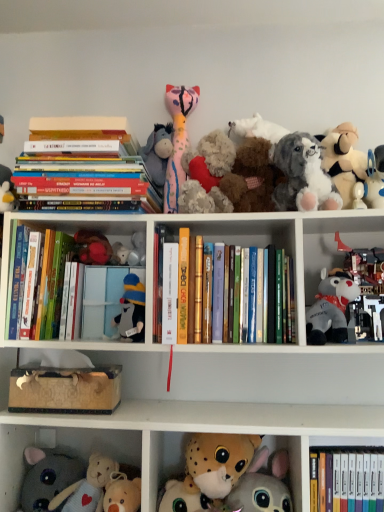
Question: Looking at the image, does fluffy plush toy at center, which is the third toy from left to right, seem bigger or smaller compared to fluffy white stuffed animal at upper right, the 1th toy from the right?

Choices:
 (A) small
 (B) big

Answer: (A)

Question: Is fluffy plush toy at center, which is the third toy from left to right, inside or outside of fluffy white stuffed animal at upper right, arranged as the ninth toy when viewed from the left?

Choices:
 (A) inside
 (B) outside

Answer: (B)

Question: Which of these objects is positioned farthest from the fluffy gray dog at upper right, placed as the 3th toy when sorted from right to left?

Choices:
 (A) hardcover book at center, the fourth book from the left
 (B) fluffy pink stuffed animal at upper center, which ranks as the fourth toy in right-to-left order
 (C) fluffy white stuffed animal at upper right, arranged as the ninth toy when viewed from the left
 (D) soft pink plush toy at upper center, placed as the sixth toy when sorted from right to left
 (E) fluffy white plush at lower center, which is the fifth toy from right to left

Answer: (E)

Question: Estimate the real-world distances between objects in this image. Which object is farther from the gray plush toy at right, which ranks as the 2th toy in right-to-left order?

Choices:
 (A) soft plush elephant at lower left, the ninth toy when ordered from right to left
 (B) hardcover book at left, the first book in the left-to-right sequence
 (C) hardcover book at center, which is the 1th paperback book from right to left
 (D) white plush toy at upper right, the first cabinet in the top-to-bottom sequence
 (E) hardcover books at upper left, positioned as the second book in left-to-right order

Answer: (A)